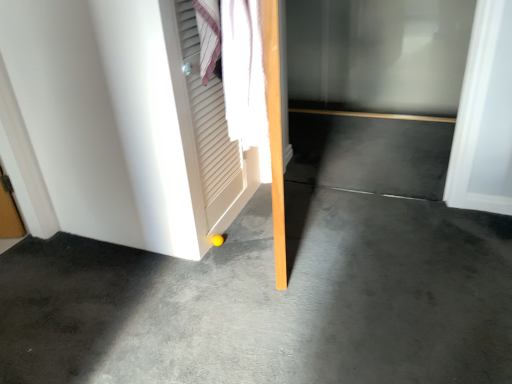
Question: In terms of height, does matte white door at lower left look taller or shorter compared to gray concrete at center?

Choices:
 (A) short
 (B) tall

Answer: (B)

Question: Is matte white door at lower left wider or thinner than gray concrete at center?

Choices:
 (A) thin
 (B) wide

Answer: (A)

Question: Which object is positioned farthest from the gray concrete at center?

Choices:
 (A) matte white door at lower left
 (B) white louvered screen door at upper left
 (C) transparent glass door at center

Answer: (C)

Question: Which of these objects is positioned closest to the transparent glass door at center?

Choices:
 (A) matte white door at lower left
 (B) white louvered screen door at upper left
 (C) gray concrete at center

Answer: (B)